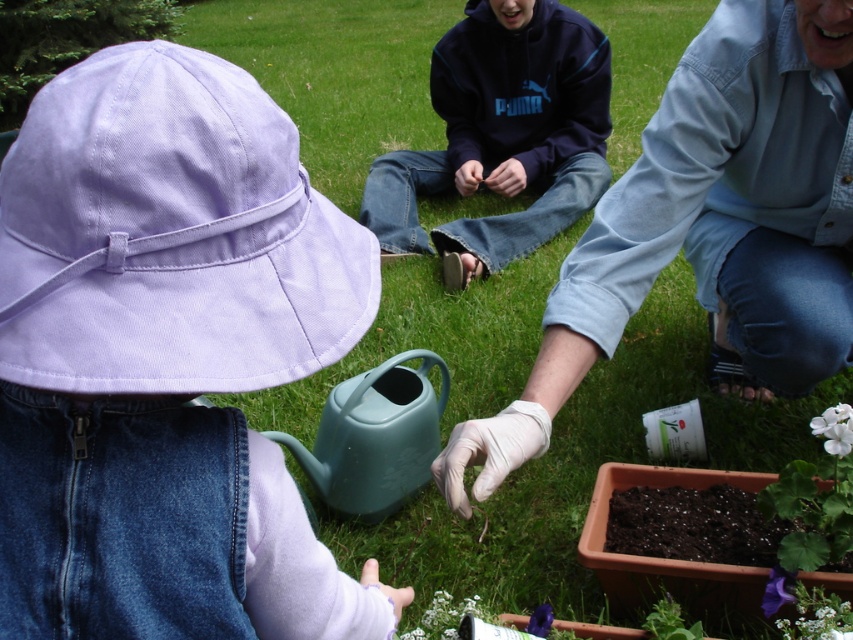
You are a photographer trying to capture the lavender cotton hat at upper left and the white matte flower at lower right in the same frame. Based on their positions, which object would appear closer to the camera in the photo?

The lavender cotton hat at upper left appears closer to the camera because it is positioned in front of the white matte flower at lower right.

Based on the photo, you are standing at the point with coordinates point (825, 448) and want to walk towards the point with coordinates point (796, 360). Will you be moving forward or backward?

Since point (796, 360) is behind point (825, 448), moving towards it would require moving backward.

You are standing in the garden scene and want to hand a tool to the person wearing the lavender cotton hat at upper left. Which direction should you move relative to the white matte flower at lower right to reach them?

The lavender cotton hat at upper left is to the left of the white matte flower at lower right, so you should move to the left of the white matte flower at lower right to reach them.